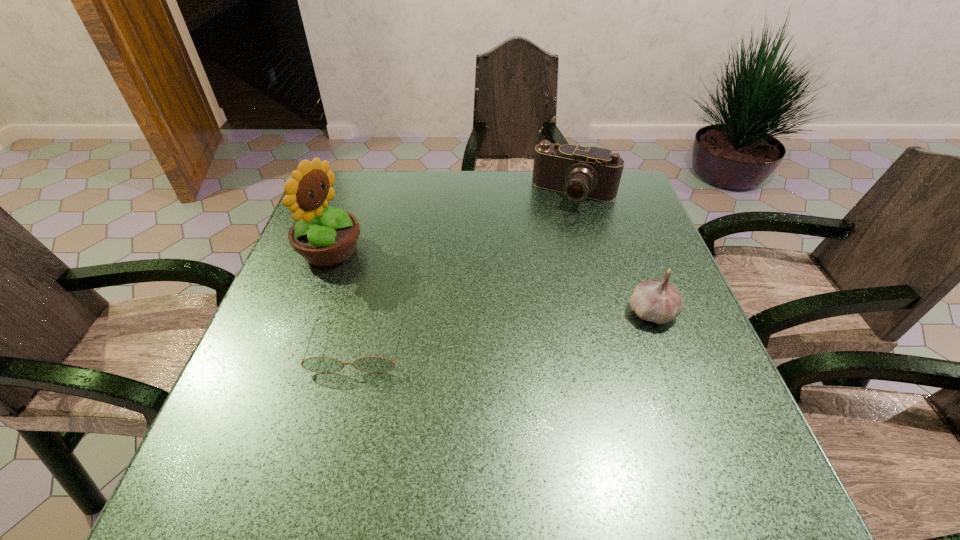
The height and width of the screenshot is (540, 960). I want to click on free spot between the camera and the garlic, so click(613, 253).

This screenshot has height=540, width=960. In order to click on unoccupied area between the garlic and the shortest object in this screenshot , I will do `click(505, 329)`.

Where is `vacant point located between the second farthest object and the sunglasses`? The image size is (960, 540). vacant point located between the second farthest object and the sunglasses is located at coordinates (344, 299).

Where is `free area in between the sunglasses and the third nearest object`? This screenshot has height=540, width=960. free area in between the sunglasses and the third nearest object is located at coordinates (344, 299).

Identify the location of blank region between the third nearest object and the garlic. (491, 281).

Locate an element on the screen. object that is the closest to the farthest object is located at coordinates (658, 301).

Point out which object is positioned as the second nearest to the second farthest object. Please provide its 2D coordinates. Your answer should be formatted as a tuple, i.e. [(x, y)], where the tuple contains the x and y coordinates of a point satisfying the conditions above.

[(579, 172)]

Find the location of a particular element. The height and width of the screenshot is (540, 960). free space in the image that satisfies the following two spatial constraints: 1. on the front side of the second farthest object; 2. on the left side of the garlic is located at coordinates (307, 313).

Where is `free space that satisfies the following two spatial constraints: 1. on the front side of the garlic; 2. on the right side of the farthest object`? This screenshot has height=540, width=960. free space that satisfies the following two spatial constraints: 1. on the front side of the garlic; 2. on the right side of the farthest object is located at coordinates (608, 313).